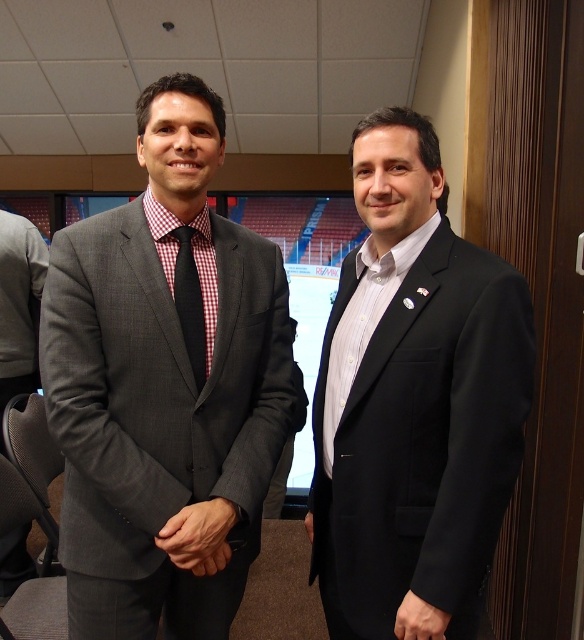
Does matte black hand at lower right appear on the left side of black matte hand at center?

In fact, matte black hand at lower right is to the right of black matte hand at center.

Is matte black hand at lower right smaller than black matte hand at center?

Yes.

Is point (404, 621) positioned after point (311, 538)?

No, (404, 621) is in front of (311, 538).

Locate an element on the screen. matte black hand at lower right is located at coordinates (419, 620).

Is point (162, 541) positioned before point (425, 627)?

No, (162, 541) is behind (425, 627).

Who is higher up, matte black hand at center or matte black hand at lower right?

matte black hand at center is above.

Locate an element on the screen. Image resolution: width=584 pixels, height=640 pixels. matte black hand at center is located at coordinates (199, 536).

Is point (418, 492) closer to camera compared to point (411, 614)?

No, (418, 492) is further to viewer.

Does black matte suit at right have a lesser width compared to matte black hand at lower right?

No.

Which is in front, point (520, 291) or point (404, 618)?

Point (520, 291) is more forward.

This screenshot has width=584, height=640. I want to click on black matte suit at right, so click(413, 397).